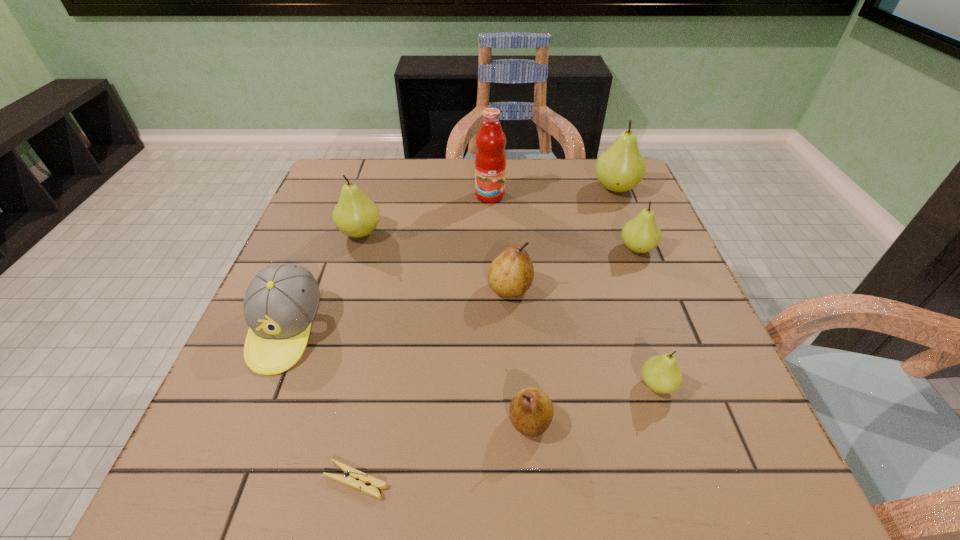
Locate an element on the screen. This screenshot has height=540, width=960. fruit juice is located at coordinates (490, 159).

In order to click on the farthest green pear in this screenshot , I will do `click(620, 168)`.

The height and width of the screenshot is (540, 960). I want to click on the biggest green pear, so click(x=620, y=168).

Identify the location of the seventh shortest object. (355, 215).

You are a GUI agent. You are given a task and a screenshot of the screen. Output one action in this format:
    pyautogui.click(x=<x>, y=<y>)
    Task: Click on the fifth shortest pear
    This screenshot has width=960, height=540.
    Given the screenshot: What is the action you would take?
    pyautogui.click(x=355, y=215)

This screenshot has width=960, height=540. I want to click on the second smallest green pear, so click(x=642, y=234).

Where is `the fourth farthest pear`? Image resolution: width=960 pixels, height=540 pixels. the fourth farthest pear is located at coordinates (511, 273).

Find the location of a particular element. The image size is (960, 540). the bigger brown pear is located at coordinates (511, 273).

Image resolution: width=960 pixels, height=540 pixels. In order to click on yellow baseball cap in this screenshot , I will do `click(281, 302)`.

Where is `the nearer brown pear`? the nearer brown pear is located at coordinates (531, 411).